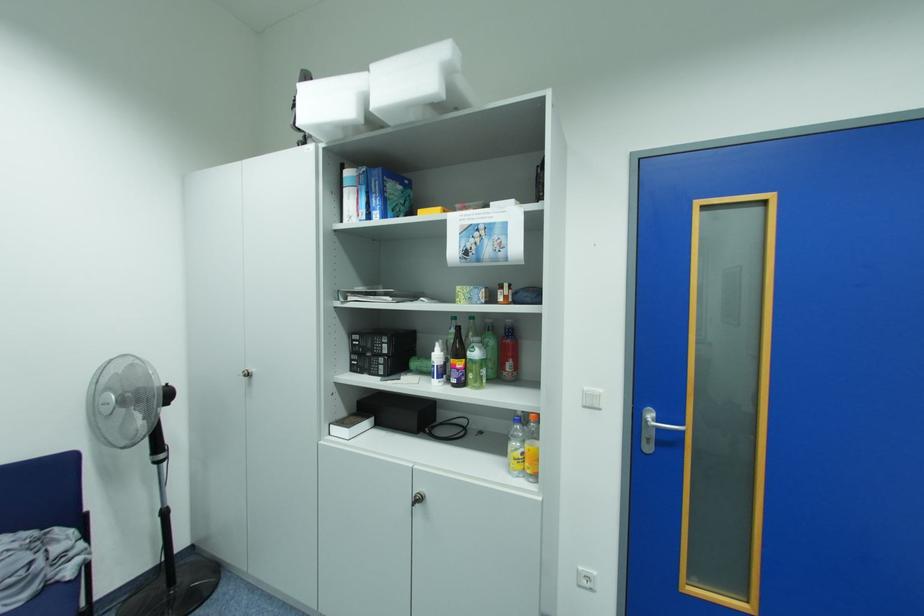
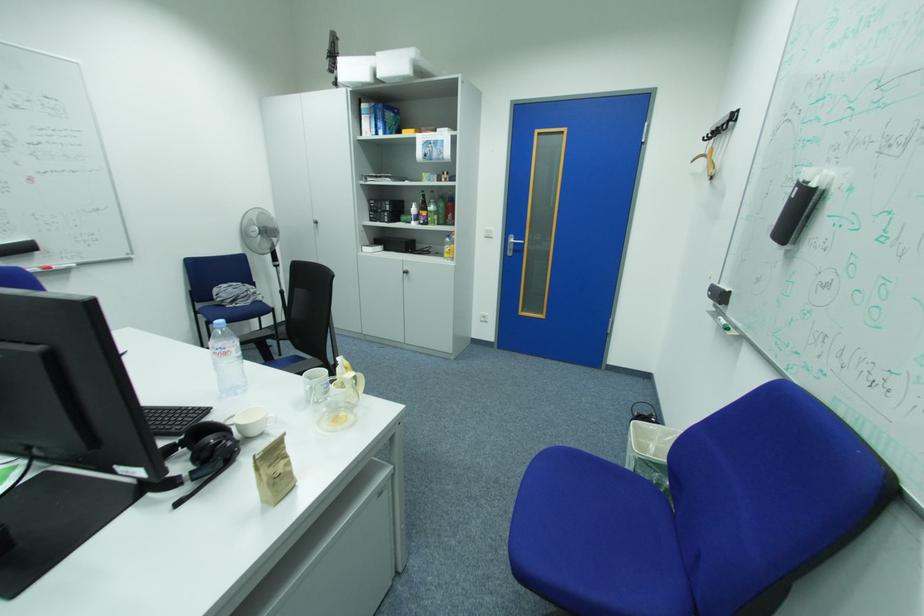
The point at (428, 500) is marked in the first image. Where is the corresponding point in the second image?

(415, 273)